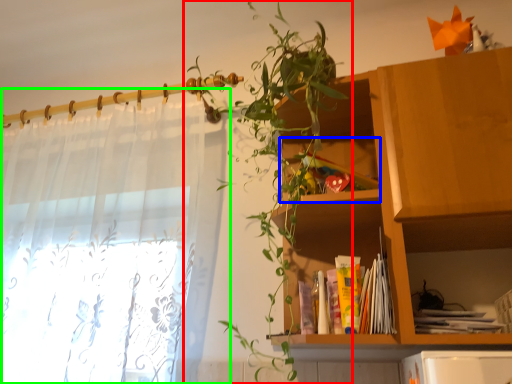
Question: Which object is positioned closest to houseplant (highlighted by a red box)? Select from cabinet (highlighted by a blue box) and curtain (highlighted by a green box).

Choices:
 (A) cabinet
 (B) curtain

Answer: (A)